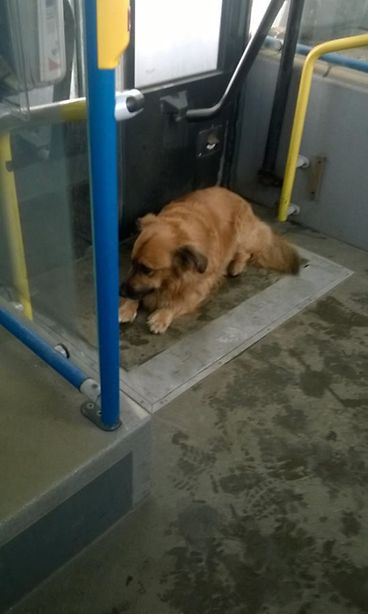
The width and height of the screenshot is (368, 614). I want to click on window, so click(x=161, y=64).